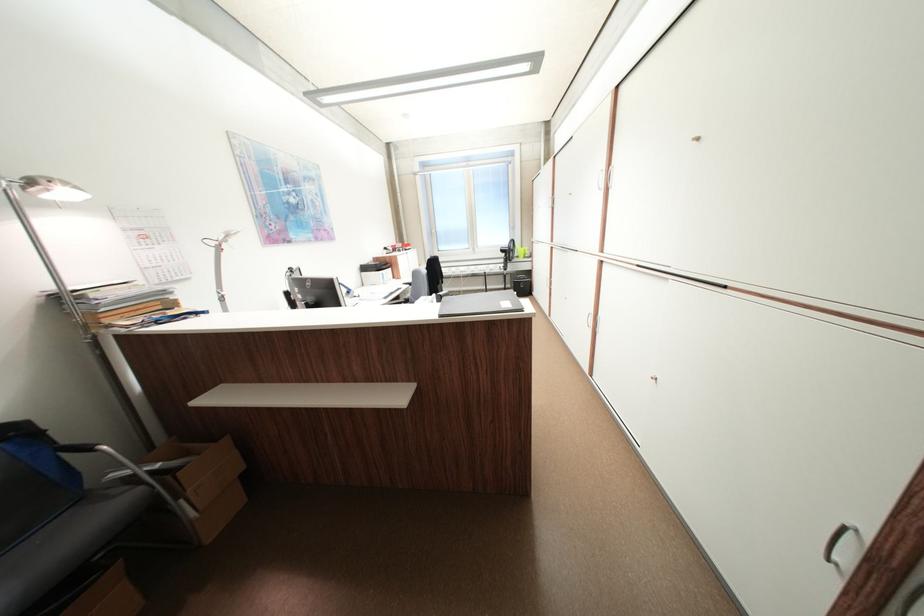
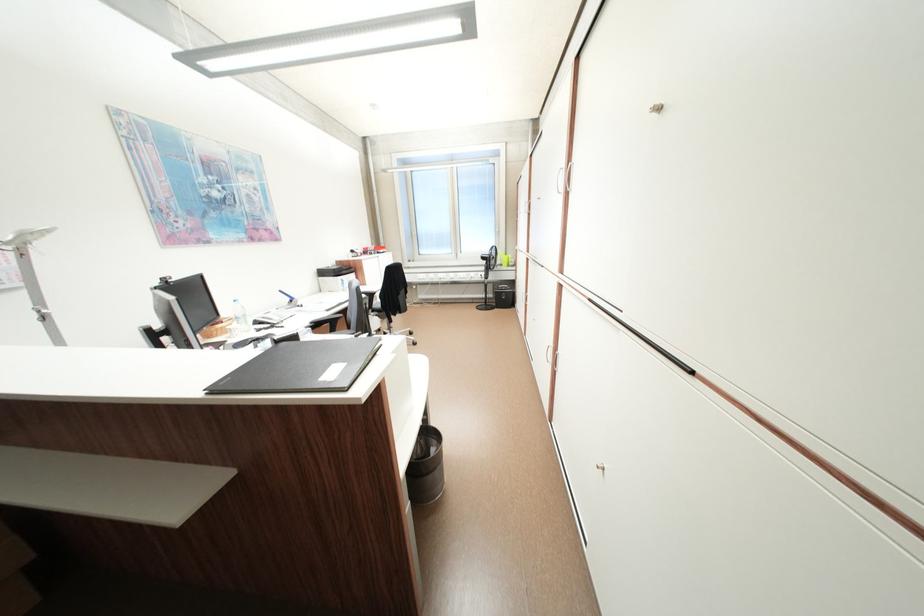
In the second image, find the point that corresponds to point (512, 252) in the first image.

(492, 259)